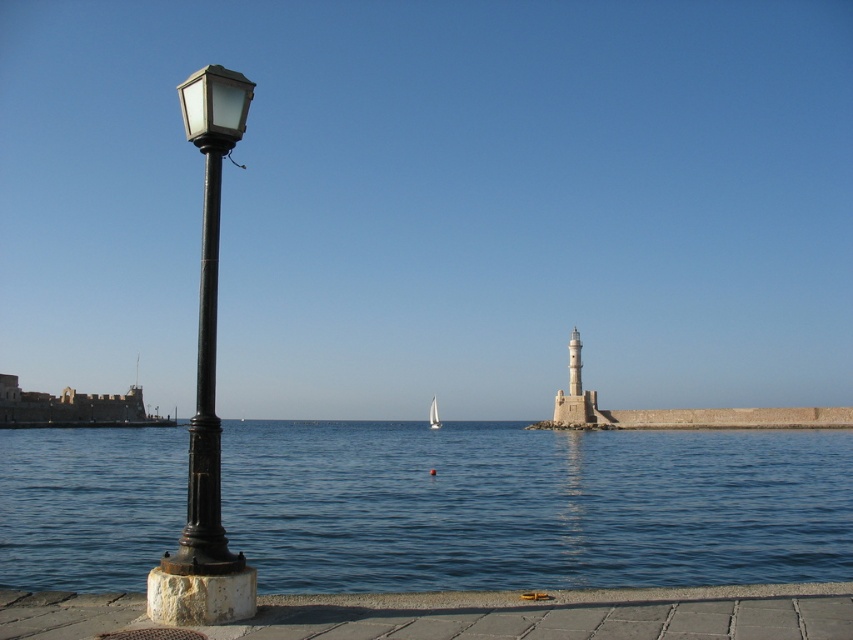
You are a photographer trying to capture the entire scene in one shot. You notice the matte black street light at left and the white sailboat at center. Which object would appear larger in your photo?

The matte black street light at left appears larger in the photo because it is physically bigger than the white sailboat at center.

You are standing on the smooth concrete sidewalk at lower center and want to look up at the matte glass streetlamp at left. Which object is taller?

The matte glass streetlamp at left is taller than the smooth concrete sidewalk at lower center.